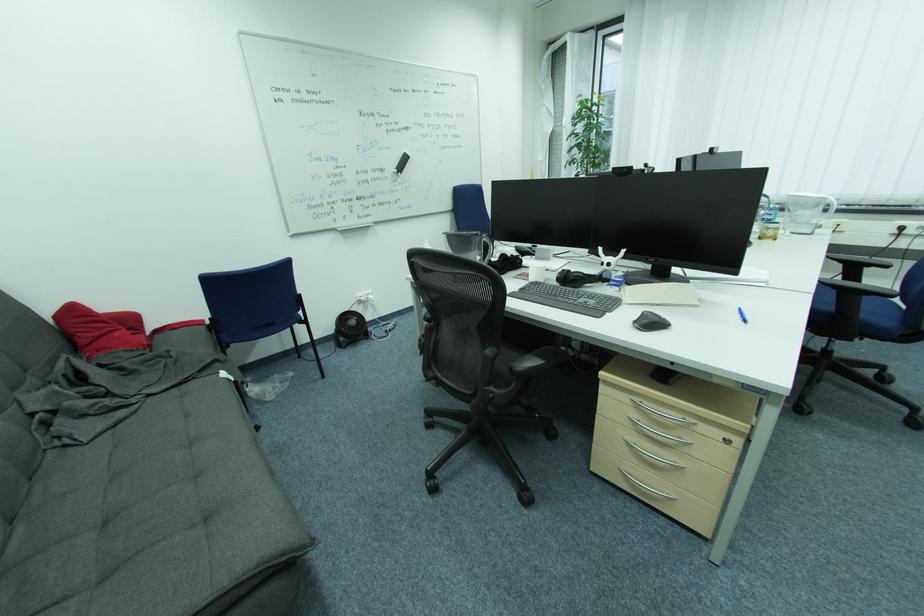
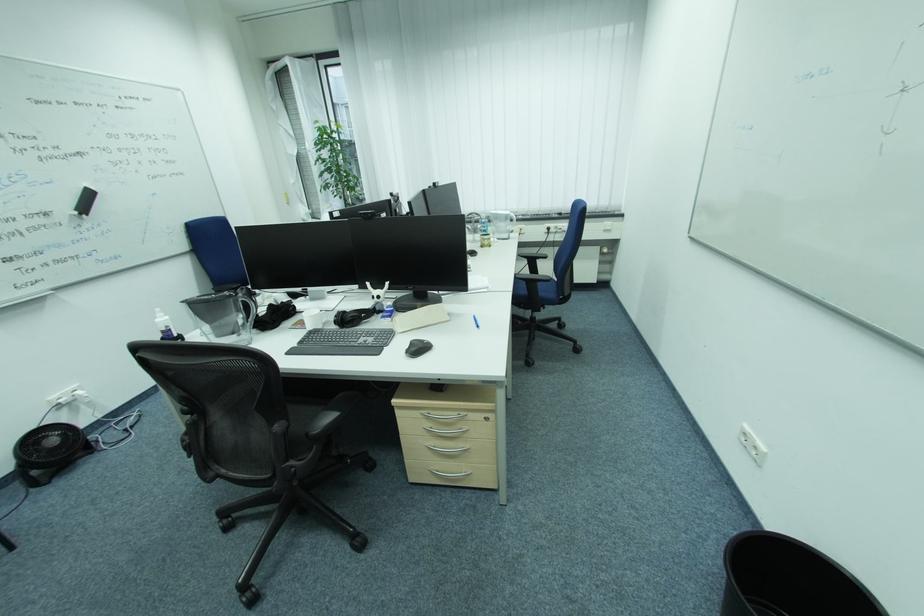
Locate, in the second image, the point that corresponds to point 641,446 in the first image.

(441, 448)